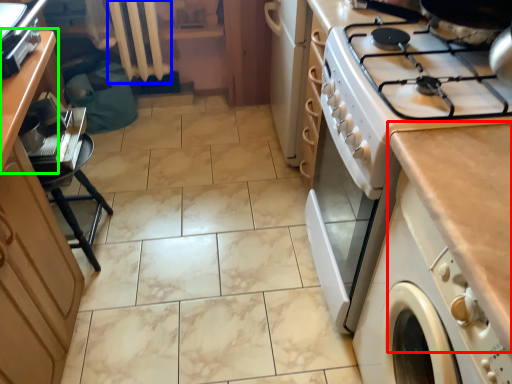
Question: Based on their relative distances, which object is farther from countertop (highlighted by a red box)? Choose from radiator (highlighted by a blue box) and counter (highlighted by a green box).

Choices:
 (A) radiator
 (B) counter

Answer: (A)